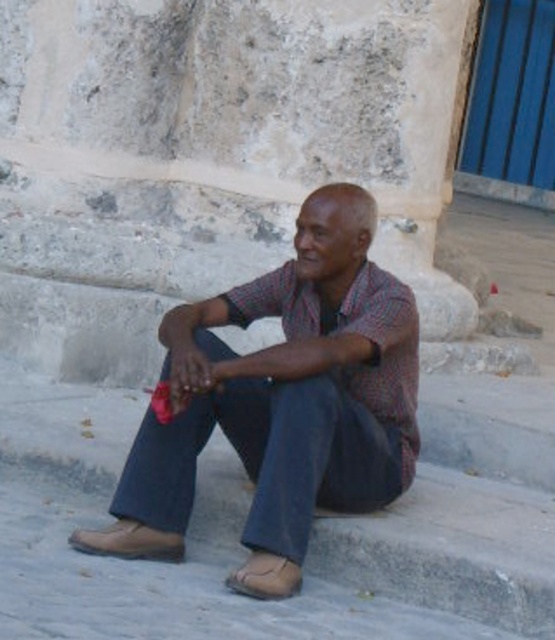
Question: Which is nearer to the brown leather sandal at lower center?

Choices:
 (A) brown leather sandal at lower left
 (B) checkered fabric shirt at center

Answer: (B)

Question: Is checkered fabric shirt at center thinner than brown leather sandal at lower center?

Choices:
 (A) no
 (B) yes

Answer: (A)

Question: Is checkered fabric shirt at center bigger than brown leather sandal at lower center?

Choices:
 (A) yes
 (B) no

Answer: (A)

Question: Among these points, which one is nearest to the camera?

Choices:
 (A) (295, 577)
 (B) (235, 422)

Answer: (A)

Question: Is checkered fabric shirt at center closer to the viewer compared to brown leather sandal at lower left?

Choices:
 (A) yes
 (B) no

Answer: (A)

Question: Estimate the real-world distances between objects in this image. Which object is closer to the checkered fabric shirt at center?

Choices:
 (A) brown leather sandal at lower center
 (B) brown leather sandal at lower left

Answer: (A)